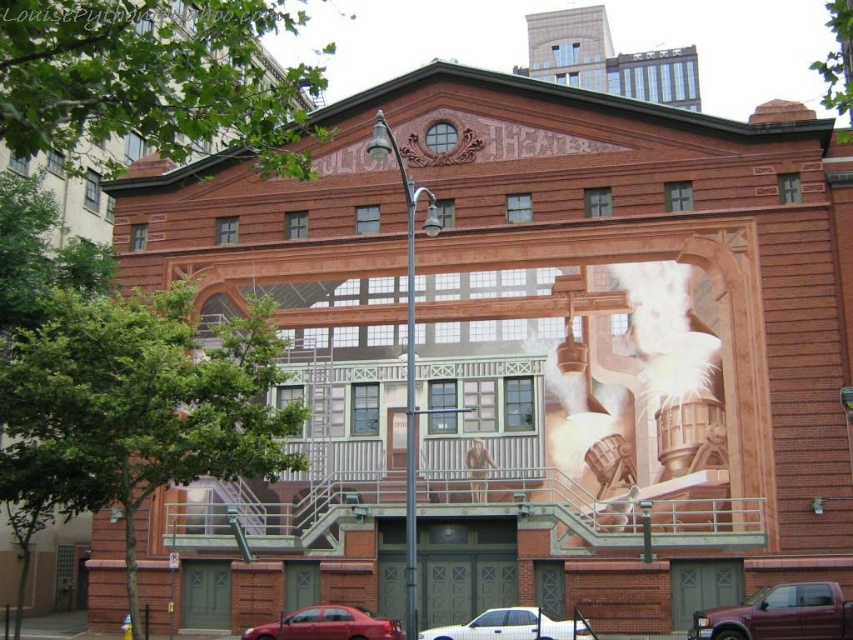
Looking at this image, can you confirm if metallic maroon pickup truck at lower right is positioned to the right of white glossy car at lower center?

Yes, metallic maroon pickup truck at lower right is to the right of white glossy car at lower center.

Does metallic maroon pickup truck at lower right appear on the left side of white glossy car at lower center?

In fact, metallic maroon pickup truck at lower right is to the right of white glossy car at lower center.

Measure the distance between metallic maroon pickup truck at lower right and camera.

metallic maroon pickup truck at lower right and camera are 142.65 feet apart from each other.

Find the location of a particular element. metallic maroon pickup truck at lower right is located at coordinates (779, 614).

Is shiny red sedan at lower center closer to the viewer compared to white glossy car at lower center?

No, shiny red sedan at lower center is further to the viewer.

Can you confirm if shiny red sedan at lower center is positioned below white glossy car at lower center?

Yes.

This screenshot has height=640, width=853. Describe the element at coordinates (328, 625) in the screenshot. I see `shiny red sedan at lower center` at that location.

The height and width of the screenshot is (640, 853). I want to click on shiny red sedan at lower center, so click(328, 625).

This screenshot has width=853, height=640. In order to click on metallic maroon pickup truck at lower right in this screenshot , I will do `click(779, 614)`.